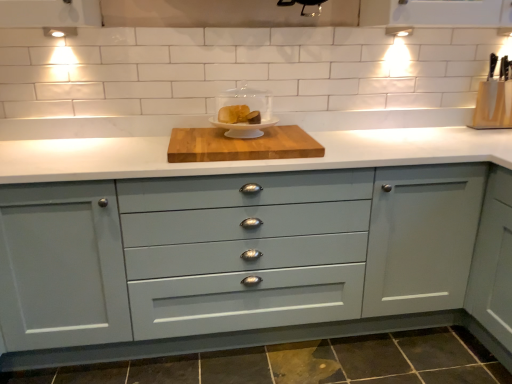
The image size is (512, 384). Describe the element at coordinates (243, 112) in the screenshot. I see `matte white cake stand at center, which appears as the 1th appliance when viewed from the left` at that location.

Describe the element at coordinates (494, 99) in the screenshot. I see `wooden knife block at upper right, the 1th appliance from the right` at that location.

The width and height of the screenshot is (512, 384). In order to click on wooden cutting board at center in this screenshot , I will do `click(241, 145)`.

Which of these two, matte gray cabinet at center or wooden cutting board at center, is bigger?

Bigger between the two is matte gray cabinet at center.

From the image's perspective, is matte gray cabinet at center located above or below wooden cutting board at center?

Clearly, from the image's perspective, matte gray cabinet at center is below wooden cutting board at center.

From a real-world perspective, which object stands above the other?

In real-world perspective, wooden cutting board at center is above.

Is matte white cake stand at center, which appears as the 1th appliance when viewed from the left, surrounding wooden cutting board at center?

No.

How many degrees apart are the facing directions of matte white cake stand at center, which appears as the 1th appliance when viewed from the left, and wooden cutting board at center?

There is a 1.22-degree angle between the facing directions of matte white cake stand at center, which appears as the 1th appliance when viewed from the left, and wooden cutting board at center.

From the image's perspective, is matte white cake stand at center, which appears as the first appliance when viewed from the front, under wooden cutting board at center?

Actually, matte white cake stand at center, which appears as the first appliance when viewed from the front, appears above wooden cutting board at center in the image.

Considering the sizes of matte white cake stand at center, which appears as the first appliance when viewed from the front, and wooden cutting board at center in the image, is matte white cake stand at center, which appears as the first appliance when viewed from the front, bigger or smaller than wooden cutting board at center?

Considering their sizes, matte white cake stand at center, which appears as the first appliance when viewed from the front, takes up less space than wooden cutting board at center.

Is wooden knife block at upper right, positioned as the 2th appliance in left-to-right order, spatially inside matte white cake stand at center, which appears as the first appliance when viewed from the front, or outside of it?

The correct answer is: outside.

Is wooden knife block at upper right, which is counted as the second appliance, starting from the front, in front of or behind matte white cake stand at center, which appears as the first appliance when viewed from the front, in the image?

wooden knife block at upper right, which is counted as the second appliance, starting from the front, is positioned farther from the viewer than matte white cake stand at center, which appears as the first appliance when viewed from the front.

From a real-world perspective, is wooden knife block at upper right, which is counted as the second appliance, starting from the front, on top of matte white cake stand at center, the 2th appliance in the right-to-left sequence?

Indeed, from a real-world perspective, wooden knife block at upper right, which is counted as the second appliance, starting from the front, stands above matte white cake stand at center, the 2th appliance in the right-to-left sequence.

Considering the points (500, 97) and (225, 115), which point is in front, point (500, 97) or point (225, 115)?

The point (225, 115) is closer to the camera.

Where is `cabinetry below the wooden knife block at upper right, which is counted as the second appliance, starting from the front (from the image's perspective)`? Image resolution: width=512 pixels, height=384 pixels. cabinetry below the wooden knife block at upper right, which is counted as the second appliance, starting from the front (from the image's perspective) is located at coordinates (320, 268).

Is wooden knife block at upper right, marked as the 1th appliance in a back-to-front arrangement, further to the viewer compared to matte gray cabinet at center?

Yes, it is behind matte gray cabinet at center.

Based on the photo, is wooden knife block at upper right, positioned as the 2th appliance in left-to-right order, wider than matte gray cabinet at center?

No, wooden knife block at upper right, positioned as the 2th appliance in left-to-right order, is not wider than matte gray cabinet at center.

Does point (490, 127) appear closer or farther from the camera than point (468, 292)?

Point (490, 127) appears to be farther away from the viewer than point (468, 292).

Find the location of `appliance above the matte white cake stand at center, the 2th appliance from the back (from a real-world perspective)`. appliance above the matte white cake stand at center, the 2th appliance from the back (from a real-world perspective) is located at coordinates (494, 99).

Would you say matte white cake stand at center, the 2th appliance from the back, is a long distance from wooden knife block at upper right, marked as the 1th appliance in a back-to-front arrangement?

Yes, matte white cake stand at center, the 2th appliance from the back, is far from wooden knife block at upper right, marked as the 1th appliance in a back-to-front arrangement.

Is wooden knife block at upper right, positioned as the 2th appliance in left-to-right order, at the back of matte white cake stand at center, which appears as the first appliance when viewed from the front?

No, matte white cake stand at center, which appears as the first appliance when viewed from the front, is not facing away from wooden knife block at upper right, positioned as the 2th appliance in left-to-right order.

From a real-world perspective, is matte white cake stand at center, which appears as the 1th appliance when viewed from the left, above or below wooden knife block at upper right, positioned as the 2th appliance in left-to-right order?

From a real-world perspective, matte white cake stand at center, which appears as the 1th appliance when viewed from the left, is physically below wooden knife block at upper right, positioned as the 2th appliance in left-to-right order.

Which object is more forward, wooden cutting board at center or matte gray cabinet at center?

matte gray cabinet at center is in front.

Looking at this image, from a real-world perspective, is wooden cutting board at center above or below matte gray cabinet at center?

Clearly, from a real-world perspective, wooden cutting board at center is above matte gray cabinet at center.

From the image's perspective, is wooden cutting board at center below matte gray cabinet at center?

No, from the image's perspective, wooden cutting board at center is not below matte gray cabinet at center.

Identify the location of cabinetry in front of the wooden knife block at upper right, which is counted as the second appliance, starting from the front. (320, 268).

Is wooden knife block at upper right, positioned as the 2th appliance in left-to-right order, at the back of matte gray cabinet at center?

No, matte gray cabinet at center is not facing away from wooden knife block at upper right, positioned as the 2th appliance in left-to-right order.

Are matte gray cabinet at center and wooden knife block at upper right, which is counted as the second appliance, starting from the front, beside each other?

They are not placed beside each other.

From the picture: From the image's perspective, relative to wooden knife block at upper right, the 1th appliance from the right, is matte gray cabinet at center above or below?

Based on their image positions, matte gray cabinet at center is located beneath wooden knife block at upper right, the 1th appliance from the right.

Locate an element on the screen. The height and width of the screenshot is (384, 512). cutting board above the matte gray cabinet at center (from the image's perspective) is located at coordinates (241, 145).

Where is `cutting board located on the left of matte white cake stand at center, which appears as the 1th appliance when viewed from the left`? cutting board located on the left of matte white cake stand at center, which appears as the 1th appliance when viewed from the left is located at coordinates (241, 145).

Considering their positions, is matte white cake stand at center, the 2th appliance in the right-to-left sequence, positioned closer to wooden cutting board at center than matte gray cabinet at center?

Based on the image, matte white cake stand at center, the 2th appliance in the right-to-left sequence, appears to be nearer to wooden cutting board at center.

Which object lies further to the anchor point wooden knife block at upper right, the 1th appliance from the right, matte gray cabinet at center or wooden cutting board at center?

wooden cutting board at center is positioned further to the anchor wooden knife block at upper right, the 1th appliance from the right.

Looking at the image, which one is located further to matte white cake stand at center, the 2th appliance in the right-to-left sequence, matte gray cabinet at center or wooden cutting board at center?

Among the two, matte gray cabinet at center is located further to matte white cake stand at center, the 2th appliance in the right-to-left sequence.

Considering their positions, is wooden cutting board at center positioned closer to matte white cake stand at center, the 2th appliance in the right-to-left sequence, than matte gray cabinet at center?

wooden cutting board at center is closer to matte white cake stand at center, the 2th appliance in the right-to-left sequence.

Looking at the image, which one is located further to wooden knife block at upper right, marked as the 1th appliance in a back-to-front arrangement, matte white cake stand at center, the 2th appliance in the right-to-left sequence, or wooden cutting board at center?

The object further to wooden knife block at upper right, marked as the 1th appliance in a back-to-front arrangement, is matte white cake stand at center, the 2th appliance in the right-to-left sequence.

Which object lies further to the anchor point matte gray cabinet at center, wooden knife block at upper right, which is counted as the second appliance, starting from the front, or matte white cake stand at center, the 2th appliance in the right-to-left sequence?

Among the two, wooden knife block at upper right, which is counted as the second appliance, starting from the front, is located further to matte gray cabinet at center.

Which object lies nearer to the anchor point matte white cake stand at center, which appears as the 1th appliance when viewed from the left, wooden knife block at upper right, the 1th appliance from the right, or wooden cutting board at center?

wooden cutting board at center is closer to matte white cake stand at center, which appears as the 1th appliance when viewed from the left.

From the image, which object appears to be nearer to wooden cutting board at center, matte white cake stand at center, which appears as the 1th appliance when viewed from the left, or wooden knife block at upper right, marked as the 1th appliance in a back-to-front arrangement?

matte white cake stand at center, which appears as the 1th appliance when viewed from the left, is closer to wooden cutting board at center.

Identify the location of appliance located between matte gray cabinet at center and wooden knife block at upper right, marked as the 1th appliance in a back-to-front arrangement, in the left-right direction. The image size is (512, 384). (243, 112).

Where is `appliance situated between wooden cutting board at center and wooden knife block at upper right, the 1th appliance from the right, from left to right`? Image resolution: width=512 pixels, height=384 pixels. appliance situated between wooden cutting board at center and wooden knife block at upper right, the 1th appliance from the right, from left to right is located at coordinates (243, 112).

Image resolution: width=512 pixels, height=384 pixels. In order to click on cutting board between matte gray cabinet at center and wooden knife block at upper right, which is counted as the second appliance, starting from the front in this screenshot , I will do tap(241, 145).

Locate an element on the screen. cutting board between matte white cake stand at center, which appears as the 1th appliance when viewed from the left, and matte gray cabinet at center vertically is located at coordinates (241, 145).